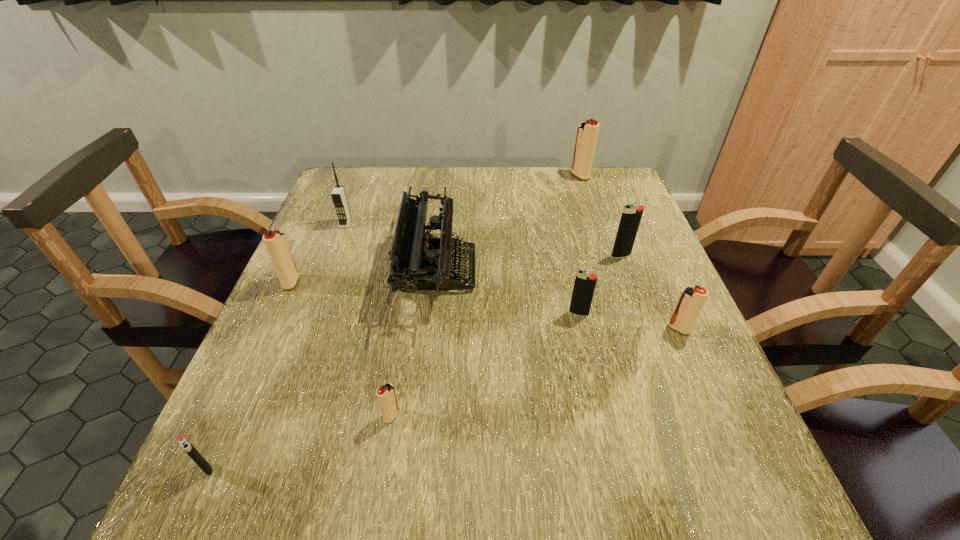
This screenshot has width=960, height=540. Identify the location of the farthest igniter. (587, 133).

The width and height of the screenshot is (960, 540). Identify the location of the farthest object. (587, 133).

You are a GUI agent. You are given a task and a screenshot of the screen. Output one action in this format:
    pyautogui.click(x=<x>, y=<y>)
    Task: Click on the cellular telephone
    This screenshot has height=540, width=960.
    Given the screenshot: What is the action you would take?
    pyautogui.click(x=338, y=195)

Where is `the second farthest red igniter`? the second farthest red igniter is located at coordinates (276, 244).

The image size is (960, 540). I want to click on the second biggest red igniter, so click(276, 244).

The image size is (960, 540). What are the coordinates of `the biggest black igniter` in the screenshot? It's located at (631, 216).

The image size is (960, 540). In order to click on the rightmost black igniter in this screenshot , I will do `click(631, 216)`.

Locate an element on the screen. This screenshot has width=960, height=540. typewriter is located at coordinates (419, 262).

Where is `the fourth igniter from left to right`? The height and width of the screenshot is (540, 960). the fourth igniter from left to right is located at coordinates (584, 286).

I want to click on the fourth farthest igniter, so click(x=584, y=286).